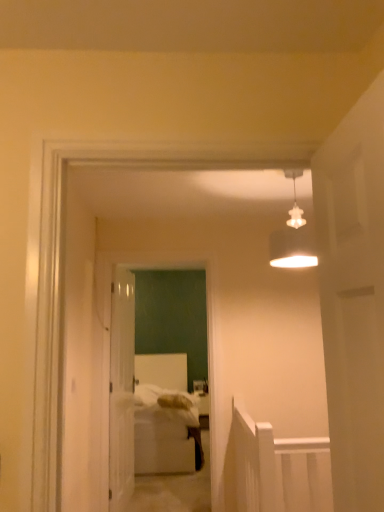
Measure the distance between white soft bed at center and camera.

The depth of white soft bed at center is 14.03 feet.

Image resolution: width=384 pixels, height=512 pixels. What do you see at coordinates (139, 408) in the screenshot?
I see `white glossy door at center` at bounding box center [139, 408].

Where is `white matte door at right, acting as the second door starting from the left`? white matte door at right, acting as the second door starting from the left is located at coordinates click(353, 298).

Considering their positions, is white matte door at right, acting as the second door starting from the left, located in front of or behind white glossy door at center, which is the first door in back-to-front order?

white matte door at right, acting as the second door starting from the left, is in front of white glossy door at center, which is the first door in back-to-front order.

Is white matte door at right, arranged as the first door when viewed from the right, looking in the opposite direction of white glossy door at center, which is the first door in back-to-front order?

No, white matte door at right, arranged as the first door when viewed from the right, is not facing away from white glossy door at center, which is the first door in back-to-front order.

Can you confirm if white matte door at right, positioned as the 1th door in front-to-back order, is positioned to the left of white glossy door at center, placed as the 1th door when sorted from left to right?

No, white matte door at right, positioned as the 1th door in front-to-back order, is not to the left of white glossy door at center, placed as the 1th door when sorted from left to right.

Considering the sizes of white matte door at right, acting as the second door starting from the left, and white glossy door at center, which is the first door in back-to-front order, in the image, is white matte door at right, acting as the second door starting from the left, taller or shorter than white glossy door at center, which is the first door in back-to-front order,?

white matte door at right, acting as the second door starting from the left, is shorter than white glossy door at center, which is the first door in back-to-front order.

Is white soft bed at center aimed at white glossy door at center, which is the first door in back-to-front order?

Yes, white soft bed at center is facing white glossy door at center, which is the first door in back-to-front order.

Is white soft bed at center not close to white glossy door at center, which is the first door in back-to-front order?

white soft bed at center is actually quite close to white glossy door at center, which is the first door in back-to-front order.

From the image's perspective, is white soft bed at center above or below white glossy door at center, marked as the 2th door in a right-to-left arrangement?

white soft bed at center is below white glossy door at center, marked as the 2th door in a right-to-left arrangement.

Looking at this image, does white glossy door at center, which is the first door in back-to-front order, have a smaller size compared to white matte lampshade at upper center?

No, white glossy door at center, which is the first door in back-to-front order, is not smaller than white matte lampshade at upper center.

Is white glossy door at center, placed as the 1th door when sorted from left to right, oriented towards white matte lampshade at upper center?

No.

You are a GUI agent. You are given a task and a screenshot of the screen. Output one action in this format:
    pyautogui.click(x=<x>, y=<y>)
    Task: Click on the light fixture above the white glossy door at center, which is the first door in back-to-front order (from a real-world perspective)
    
    Given the screenshot: What is the action you would take?
    pyautogui.click(x=293, y=237)

Considering the relative sizes of white glossy door at center, which is the second door in front-to-back order, and white matte lampshade at upper center in the image provided, is white glossy door at center, which is the second door in front-to-back order, shorter than white matte lampshade at upper center?

Incorrect, the height of white glossy door at center, which is the second door in front-to-back order, does not fall short of that of white matte lampshade at upper center.

Where is `light fixture above the white glossy door at center (from a real-world perspective)`? light fixture above the white glossy door at center (from a real-world perspective) is located at coordinates (293, 237).

From a real-world perspective, is white glossy door at center above or below white matte lampshade at upper center?

In terms of real-world spatial position, white glossy door at center is below white matte lampshade at upper center.

Which point is more forward, (196, 409) or (301, 222)?

The point (301, 222) is more forward.

Is point (348, 234) closer or farther from the camera than point (171, 452)?

Point (348, 234) appears to be closer to the viewer than point (171, 452).

Can you confirm if white matte door at right, arranged as the first door when viewed from the right, is taller than white soft bed at center?

In fact, white matte door at right, arranged as the first door when viewed from the right, may be shorter than white soft bed at center.

Between white matte door at right, acting as the second door starting from the left, and white soft bed at center, which one has larger size?

white soft bed at center is bigger.

Which is correct: white matte door at right, arranged as the first door when viewed from the right, is inside white soft bed at center, or outside of it?

white matte door at right, arranged as the first door when viewed from the right, exists outside the volume of white soft bed at center.

How far apart are white matte door at right, acting as the second door starting from the left, and white matte lampshade at upper center?

white matte door at right, acting as the second door starting from the left, and white matte lampshade at upper center are 37.18 inches apart from each other.

From the image's perspective, starting from the white matte lampshade at upper center, which door is the 1st one below? Please provide its 2D coordinates.

[(353, 298)]

Considering the relative sizes of white matte door at right, which is counted as the 2th door, starting from the back, and white matte lampshade at upper center in the image provided, is white matte door at right, which is counted as the 2th door, starting from the back, shorter than white matte lampshade at upper center?

No.

Is point (363, 334) closer or farther from the camera than point (294, 180)?

Point (363, 334).

From a real-world perspective, which object rests below the other?

white soft bed at center is physically lower.

Based on the photo, is white glossy door at center not inside white soft bed at center?

Yes, white glossy door at center is not within white soft bed at center.

How many degrees apart are the facing directions of white glossy door at center and white soft bed at center?

The angle between the facing direction of white glossy door at center and the facing direction of white soft bed at center is 0.104 degrees.

Based on their positions, is white glossy door at center located to the left or right of white soft bed at center?

From the image, it's evident that white glossy door at center is to the right of white soft bed at center.

I want to click on door below the white matte door at right, positioned as the 1th door in front-to-back order (from a real-world perspective), so click(x=121, y=389).

At what (x,y) coordinates should I click in order to perform the action: click on the 1st door above when counting from the white soft bed at center (from the image's perspective). Please return your answer as a coordinate pair (x, y). Looking at the image, I should click on (121, 389).

Considering their positions, is white matte door at right, acting as the second door starting from the left, positioned closer to white soft bed at center than white matte lampshade at upper center?

white matte lampshade at upper center is positioned closer to the anchor white soft bed at center.

Which object lies nearer to the anchor point white matte lampshade at upper center, white soft bed at center or white matte door at right, which is counted as the 2th door, starting from the back?

The object closer to white matte lampshade at upper center is white matte door at right, which is counted as the 2th door, starting from the back.

In the scene shown: Which object lies further to the anchor point white matte door at right, positioned as the 1th door in front-to-back order, white glossy door at center, marked as the 2th door in a right-to-left arrangement, or white soft bed at center?

white soft bed at center is further to white matte door at right, positioned as the 1th door in front-to-back order.

Considering their positions, is white glossy door at center, placed as the 1th door when sorted from left to right, positioned further to white soft bed at center than white matte door at right, which is counted as the 2th door, starting from the back?

white matte door at right, which is counted as the 2th door, starting from the back.

Based on the photo, when comparing their distances from white glossy door at center, does white glossy door at center, which is the first door in back-to-front order, or white soft bed at center seem closer?

Based on the image, white glossy door at center, which is the first door in back-to-front order, appears to be nearer to white glossy door at center.

Estimate the real-world distances between objects in this image. Which object is closer to white glossy door at center, white matte door at right, positioned as the 1th door in front-to-back order, or white soft bed at center?

Based on the image, white soft bed at center appears to be nearer to white glossy door at center.

Estimate the real-world distances between objects in this image. Which object is closer to white matte lampshade at upper center, white matte door at right, positioned as the 1th door in front-to-back order, or white glossy door at center, marked as the 2th door in a right-to-left arrangement?

Based on the image, white matte door at right, positioned as the 1th door in front-to-back order, appears to be nearer to white matte lampshade at upper center.

When comparing their distances from white soft bed at center, does white glossy door at center or white glossy door at center, marked as the 2th door in a right-to-left arrangement, seem further?

white glossy door at center, marked as the 2th door in a right-to-left arrangement, is further to white soft bed at center.

Find the location of a particular element. The width and height of the screenshot is (384, 512). glass door positioned between white matte door at right, acting as the second door starting from the left, and white glossy door at center, marked as the 2th door in a right-to-left arrangement, from near to far is located at coordinates (139, 408).

Locate an element on the screen. This screenshot has height=512, width=384. light fixture between white matte door at right, which is counted as the 2th door, starting from the back, and white glossy door at center, marked as the 2th door in a right-to-left arrangement, in the front-back direction is located at coordinates (293, 237).

Identify the location of glass door between white matte lampshade at upper center and white glossy door at center, placed as the 1th door when sorted from left to right, in the up-down direction. (139, 408).

The height and width of the screenshot is (512, 384). I want to click on light fixture positioned between white matte door at right, which is counted as the 2th door, starting from the back, and white glossy door at center from near to far, so tap(293, 237).